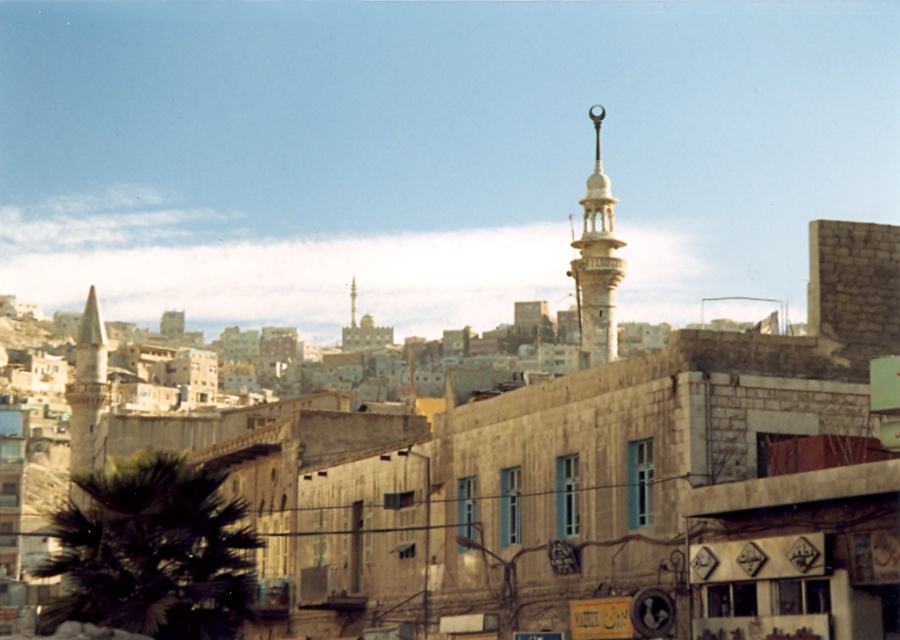
Question: Which object is positioned closest to the smooth stone minaret at center?

Choices:
 (A) dark green leafy palm tree at lower left
 (B) white stone minaret at center

Answer: (B)

Question: Is dark green leafy palm tree at lower left positioned in front of white stone minaret at center?

Choices:
 (A) yes
 (B) no

Answer: (A)

Question: Does stone tower at left appear under smooth stone minaret at center?

Choices:
 (A) yes
 (B) no

Answer: (A)

Question: Which object is the farthest from the dark green leafy palm tree at lower left?

Choices:
 (A) smooth stone minaret at center
 (B) stone tower at left
 (C) white stone minaret at center

Answer: (A)

Question: Which object is farther from the camera taking this photo?

Choices:
 (A) dark green leafy palm tree at lower left
 (B) smooth stone minaret at center
 (C) stone tower at left
 (D) white stone minaret at center

Answer: (B)

Question: Does dark green leafy palm tree at lower left have a larger size compared to stone tower at left?

Choices:
 (A) yes
 (B) no

Answer: (B)